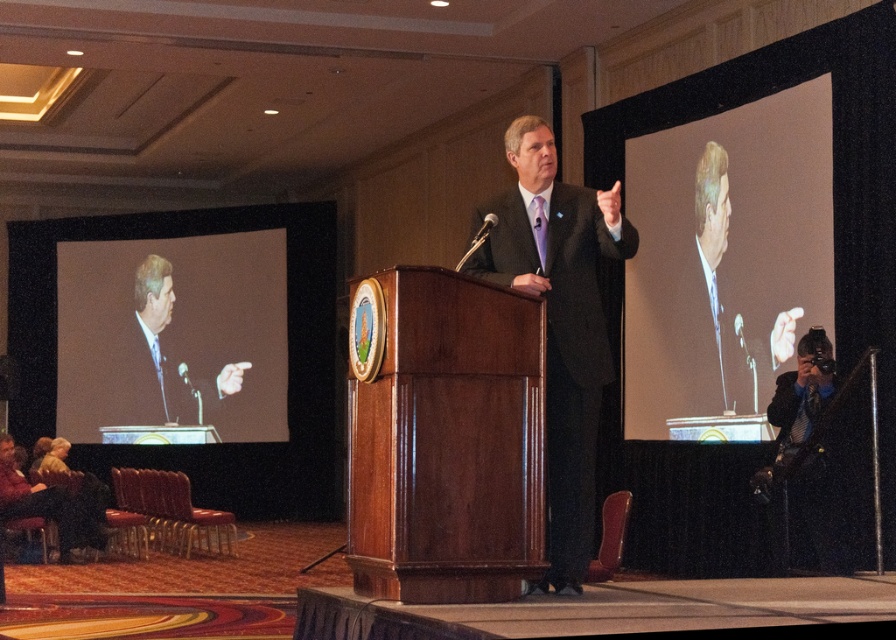
Who is more forward, [830,387] or [58,515]?

Point [830,387] is in front.

The image size is (896, 640). Find the location of `black leather camera at right`. black leather camera at right is located at coordinates (802, 456).

Which is more to the right, matte black screen at upper right or smooth blue suit at upper right?

Positioned to the right is smooth blue suit at upper right.

What are the coordinates of `matte black screen at upper right` in the screenshot? It's located at [725, 260].

Who is more distant from viewer, (750,374) or (714,323)?

Point (714,323)

The height and width of the screenshot is (640, 896). Identify the location of matte black screen at upper right. (725, 260).

Between matte black screen at upper right and matte black suit at center, which one is positioned higher?

matte black screen at upper right is above.

Between matte black screen at upper right and matte black suit at center, which one appears on the left side from the viewer's perspective?

Positioned to the left is matte black suit at center.

Find the location of `matte black screen at upper right`. matte black screen at upper right is located at coordinates (725, 260).

Locate an element on the screen. matte black screen at upper right is located at coordinates (725, 260).